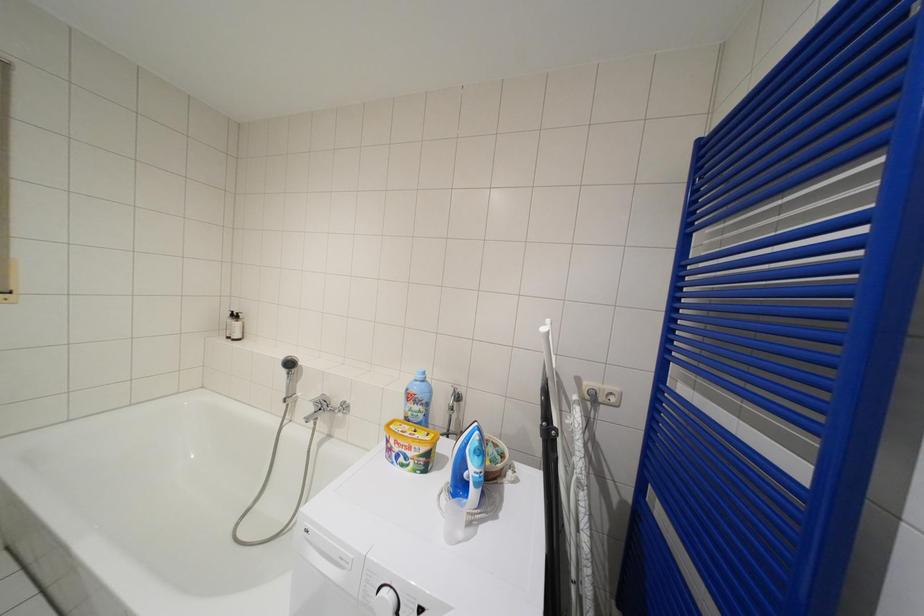
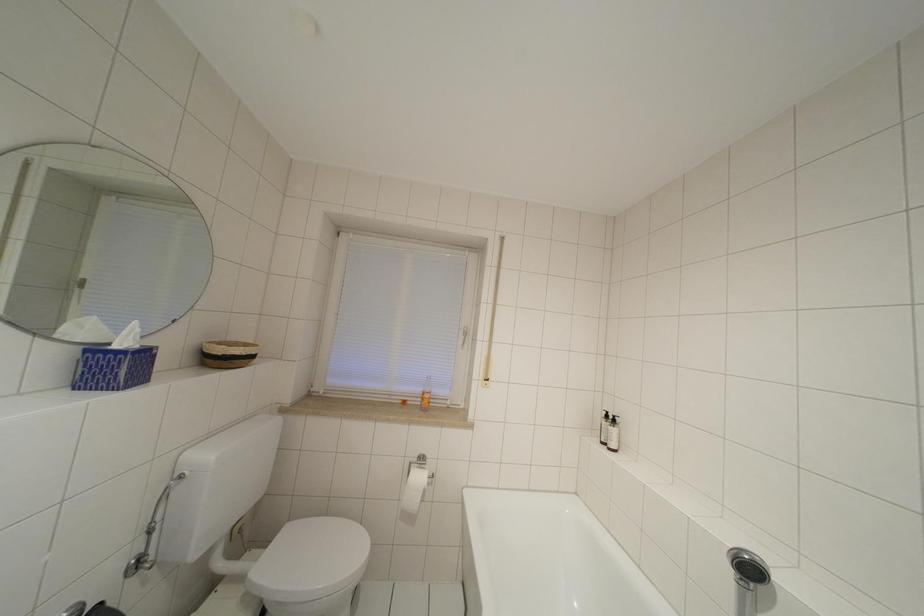
Question: Based on the continuous images, in which direction is the camera rotating? Reply with the corresponding letter.

Choices:
 (A) Left
 (B) Right
 (C) Up
 (D) Down

Answer: (A)